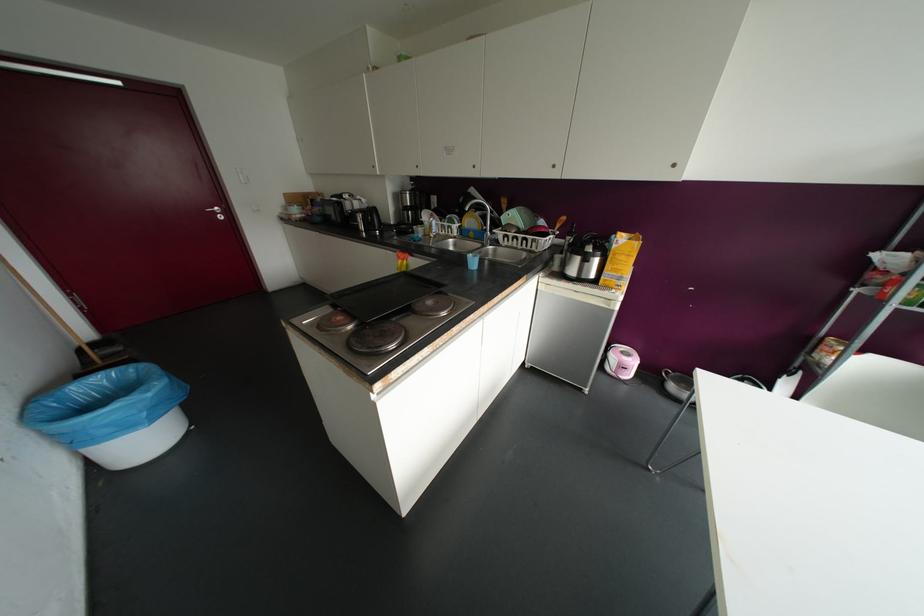
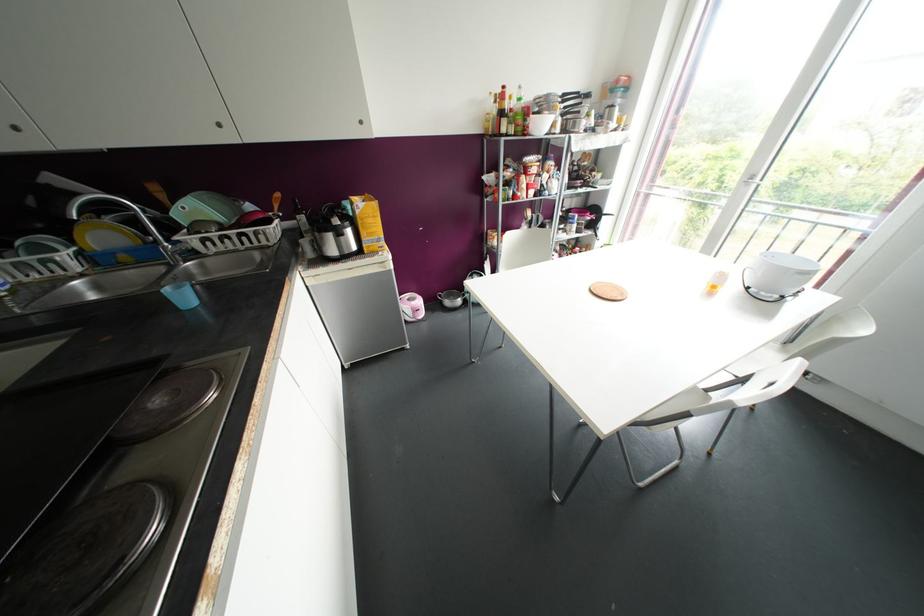
In the second image, find the point that corresponds to [494,241] in the first image.

(192, 253)